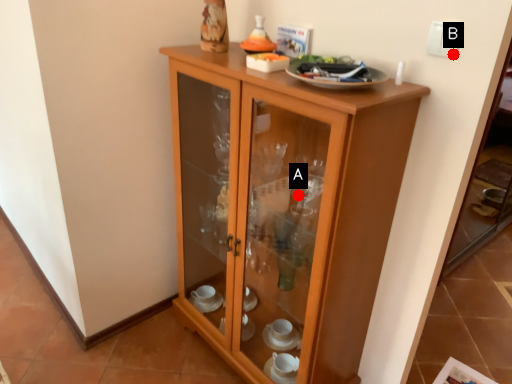
Question: Two points are circled on the image, labeled by A and B beside each circle. Which of the following is the farthest from the observer?

Choices:
 (A) A is further
 (B) B is further

Answer: (A)